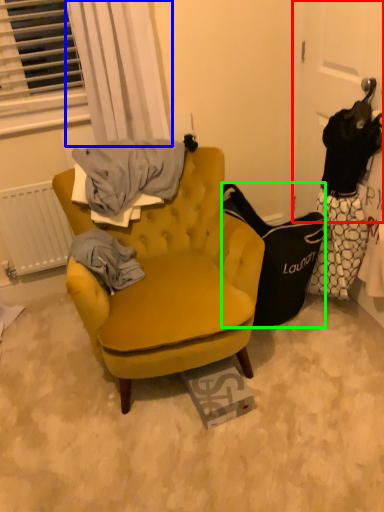
Question: Considering the real-world distances, which object is farthest from door (highlighted by a red box)? curtain (highlighted by a blue box) or handbag (highlighted by a green box)?

Choices:
 (A) curtain
 (B) handbag

Answer: (A)